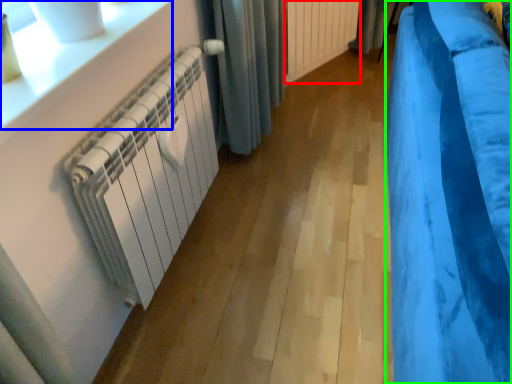
Question: Which object is the closest to the radiator (highlighted by a red box)? Choose among these: window sill (highlighted by a blue box) or curtain (highlighted by a green box).

Choices:
 (A) window sill
 (B) curtain

Answer: (B)